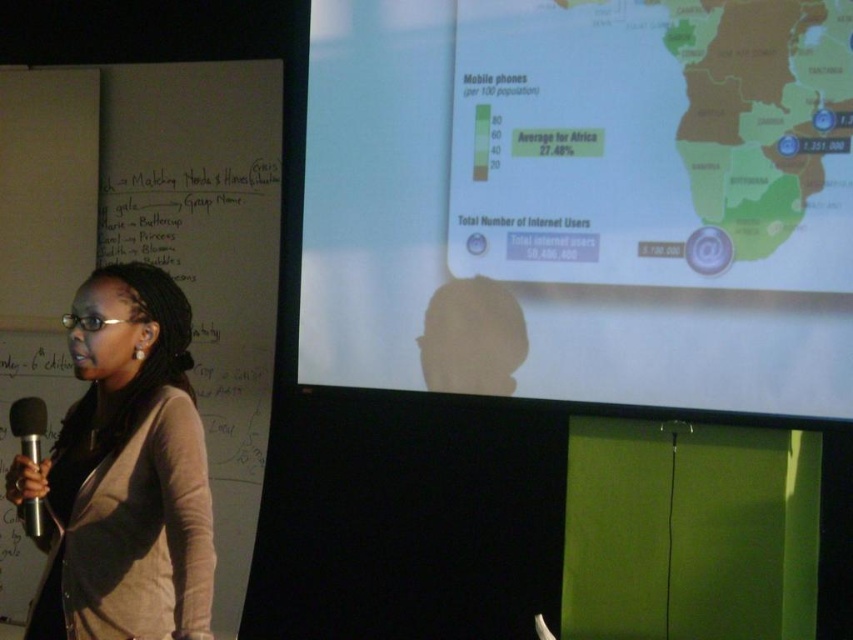
Between point (775, 16) and point (9, 426), which one is positioned behind?

Point (9, 426)

I want to click on white matte projection screen at upper center, so click(x=581, y=200).

Is white matte projection screen at upper center above matte black jacket at left?

Yes.

You are a GUI agent. You are given a task and a screenshot of the screen. Output one action in this format:
    pyautogui.click(x=<x>, y=<y>)
    Task: Click on the white matte projection screen at upper center
    
    Given the screenshot: What is the action you would take?
    pyautogui.click(x=581, y=200)

Which is above, matte black jacket at left or silver metallic microphone at lower left?

matte black jacket at left is above.

Who is lower down, matte black jacket at left or silver metallic microphone at lower left?

silver metallic microphone at lower left

What do you see at coordinates (125, 472) in the screenshot? The height and width of the screenshot is (640, 853). I see `matte black jacket at left` at bounding box center [125, 472].

The image size is (853, 640). Identify the location of matte black jacket at left. (125, 472).